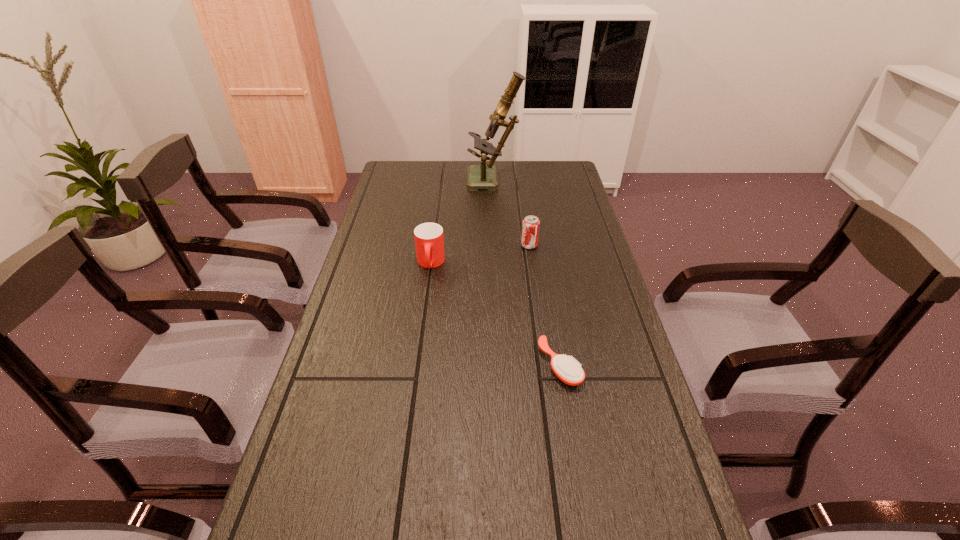
Where is `the tallest object`? the tallest object is located at coordinates (483, 176).

Where is `microscope`? This screenshot has width=960, height=540. microscope is located at coordinates tap(483, 176).

The image size is (960, 540). Identify the location of the second nearest object. (429, 241).

Locate an element on the screen. The height and width of the screenshot is (540, 960). cup is located at coordinates coord(429,241).

I want to click on soda can, so click(x=530, y=228).

The height and width of the screenshot is (540, 960). I want to click on the nearest object, so click(x=568, y=370).

The width and height of the screenshot is (960, 540). Identify the location of hairbrush. (568, 370).

At what (x,y) coordinates should I click in order to perform the action: click on vacant space located at the eyepiece of the farthest object. Please return your answer as a coordinate pair (x, y). The height and width of the screenshot is (540, 960). Looking at the image, I should click on (402, 182).

You are a GUI agent. You are given a task and a screenshot of the screen. Output one action in this format:
    pyautogui.click(x=<x>, y=<y>)
    Task: Click on the blank space located 0.240m at the eyepiece of the farthest object
    
    Given the screenshot: What is the action you would take?
    pyautogui.click(x=407, y=182)

This screenshot has width=960, height=540. I want to click on free location located at the eyepiece of the farthest object, so click(x=443, y=182).